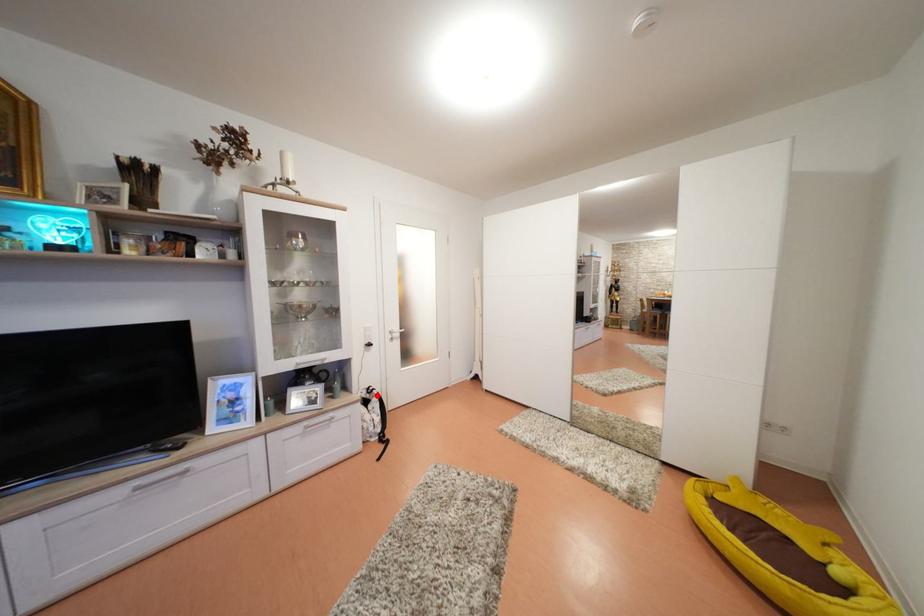
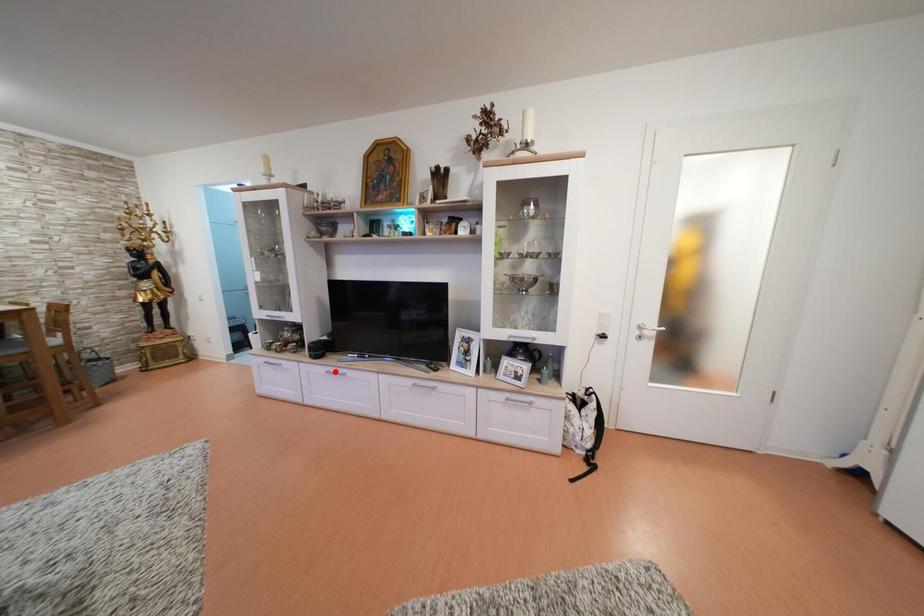
I am providing you with two images of the same scene from different viewpoints. A red point is marked on the first image and another point is marked on the second image. Is the red point in image1 aligned with the point shown in image2?

No